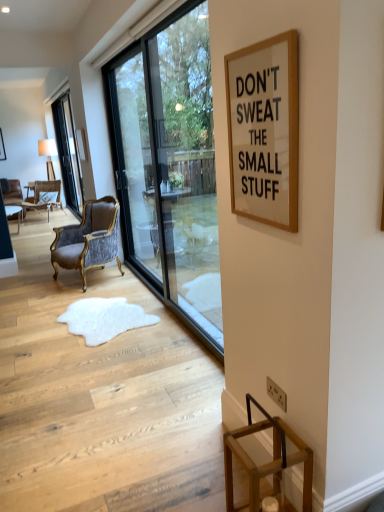
Question: Is point (11, 212) positioned closer to the camera than point (150, 248)?

Choices:
 (A) farther
 (B) closer

Answer: (A)

Question: Is wooden table at left wider or thinner than transparent glass screen door at center?

Choices:
 (A) wide
 (B) thin

Answer: (A)

Question: Estimate the real-world distances between objects in this image. Which object is closer to the clear glass window at left, acting as the 2th window starting from the right?

Choices:
 (A) velvet upholstered chair at left, the second chair from the front
 (B) wooden table at left
 (C) transparent glass window at center, acting as the second window starting from the left
 (D) wooden picture frame at upper left
 (E) white fur rug at center

Answer: (A)

Question: Which object is positioned closest to the velvet upholstered armchair at center, which appears as the 1th chair when viewed from the front?

Choices:
 (A) transparent glass window at center, arranged as the 2th window when viewed from the back
 (B) clear glass window at left, which is counted as the 2th window, starting from the front
 (C) transparent glass screen door at center
 (D) velvet upholstered chair at left, which is the 2th chair in bottom-to-top order
 (E) white paperboard at upper right

Answer: (C)